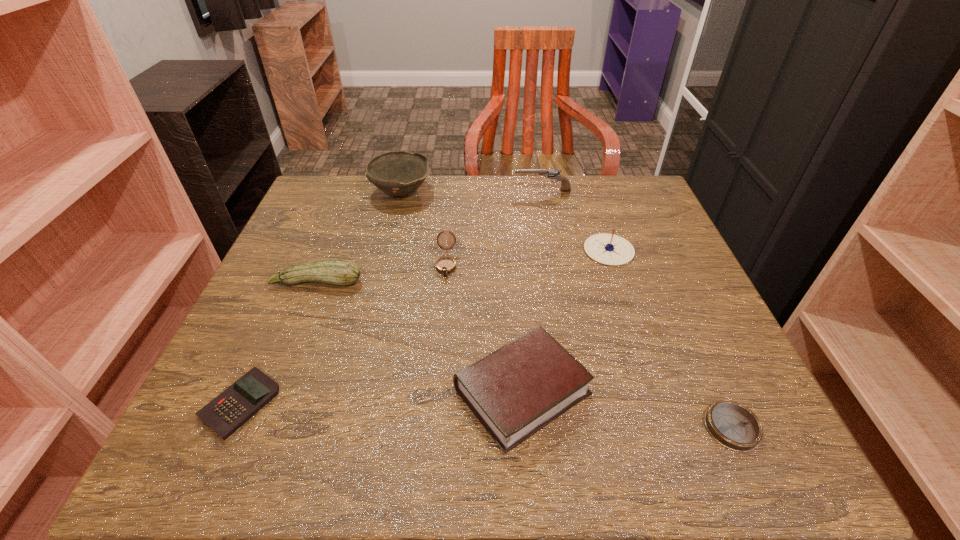
Identify the location of vacant space located aiming along the barrel of the gun. The height and width of the screenshot is (540, 960). (438, 190).

Identify the location of vacant space situated 0.270m aiming along the barrel of the gun. (416, 190).

What are the coordinates of `vacant area situated 0.240m aiming along the barrel of the gun` in the screenshot? It's located at (426, 190).

I want to click on vacant position located 0.110m on the left of the second compass from left to right, so click(x=537, y=250).

This screenshot has height=540, width=960. What are the coordinates of `blank space located on the face of the fifth object from right to left` in the screenshot? It's located at (438, 362).

Locate an element on the screen. The image size is (960, 540). vacant space located at the stem end of the zucchini is located at coordinates (275, 391).

Where is `blank space located 0.170m on the right of the Bible`? blank space located 0.170m on the right of the Bible is located at coordinates (x=692, y=392).

Where is `free point located on the back of the calculator`? The height and width of the screenshot is (540, 960). free point located on the back of the calculator is located at coordinates (301, 265).

What are the coordinates of `vacant space located on the left of the rightmost compass` in the screenshot? It's located at (541, 427).

At what (x,y) coordinates should I click in order to perform the action: click on bowl present at the far edge. Please return your answer as a coordinate pair (x, y). Looking at the image, I should click on (x=397, y=173).